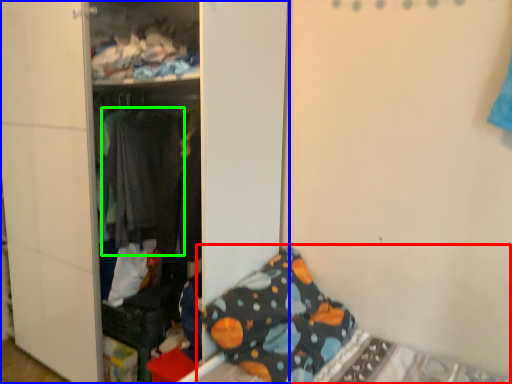
Question: Estimate the real-world distances between objects in this image. Which object is closer to bed (highlighted by a red box), furniture (highlighted by a blue box) or clothing (highlighted by a green box)?

Choices:
 (A) furniture
 (B) clothing

Answer: (A)